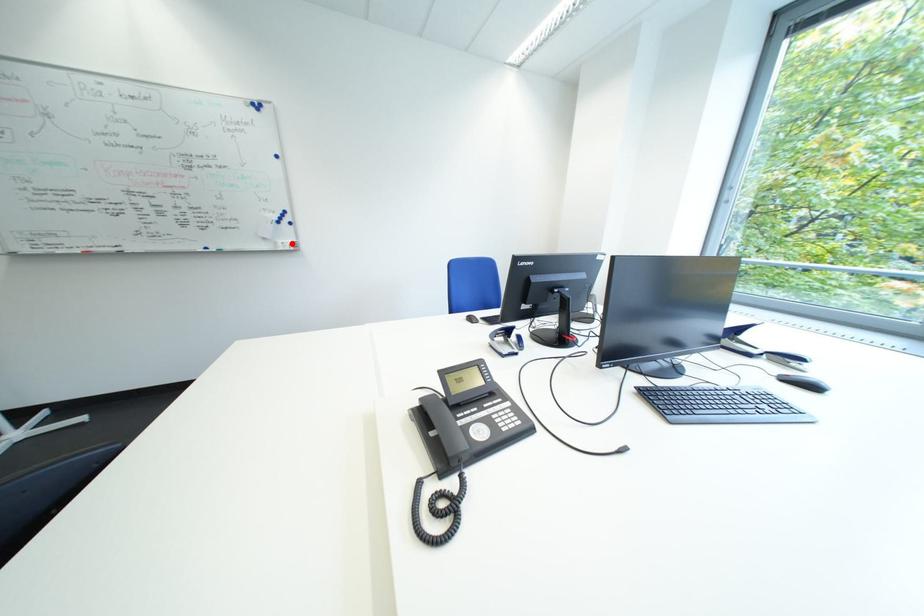
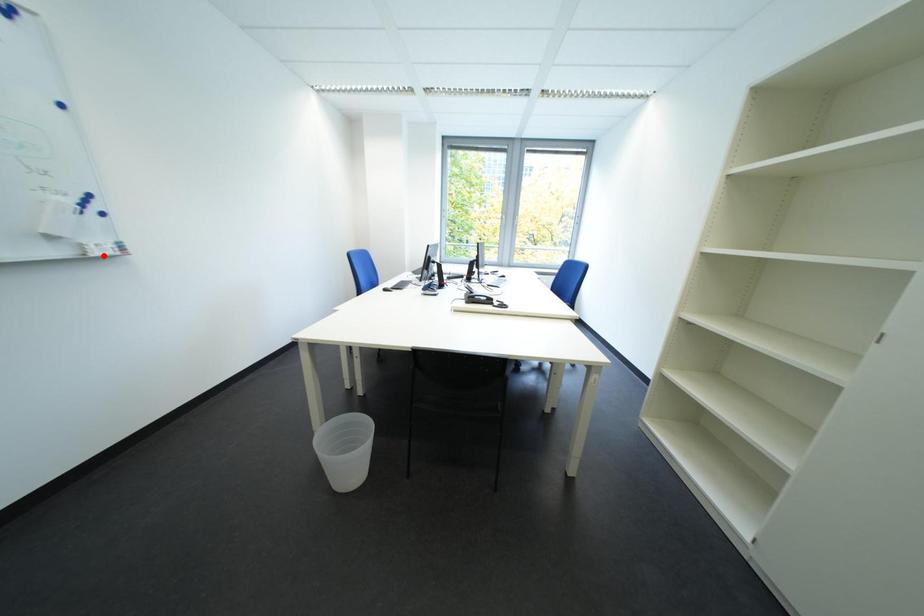
I am providing you with two images of the same scene from different viewpoints. A red point is marked on the first image and another point is marked on the second image. Do the highlighted points in image1 and image2 indicate the same real-world spot?

No